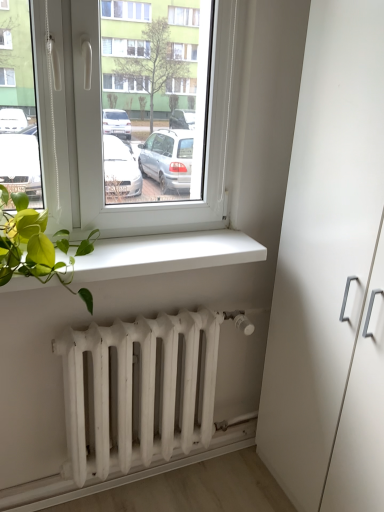
What is the approximate width of white matte window sill at lower center?

white matte window sill at lower center is 9.66 inches wide.

What do you see at coordinates (139, 392) in the screenshot? I see `white matte radiator at lower center` at bounding box center [139, 392].

Locate an element on the screen. The image size is (384, 512). white matte cabinet at right is located at coordinates (321, 249).

Locate an element on the screen. Image resolution: width=384 pixels, height=512 pixels. white matte radiator at lower center is located at coordinates (121, 473).

Can you confirm if white matte radiator at lower center is taller than white matte window sill at lower center?

Yes.

From a real-world perspective, relative to white matte window sill at lower center, is white matte radiator at lower center vertically above or below?

white matte radiator at lower center is below white matte window sill at lower center.

Is white matte radiator at lower center facing away from white matte window sill at lower center?

No, white matte radiator at lower center is not facing away from white matte window sill at lower center.

Considering the positions of points (193, 448) and (204, 251), is point (193, 448) farther from camera compared to point (204, 251)?

Yes, it is behind point (204, 251).

In the scene shown: Is white matte cabinet at right oriented towards white matte window sill at lower center?

Yes, white matte cabinet at right is facing white matte window sill at lower center.

Is point (292, 354) closer to camera compared to point (128, 271)?

No, it is behind (128, 271).

Does white matte cabinet at right appear on the left side of white matte window sill at lower center?

In fact, white matte cabinet at right is to the right of white matte window sill at lower center.

From a real-world perspective, who is located higher, white matte cabinet at right or white matte window sill at lower center?

In real-world perspective, white matte window sill at lower center is above.

From the picture: Which object is wider, white matte window sill at lower center or white matte radiator at lower center?

With larger width is white matte window sill at lower center.

The image size is (384, 512). In order to click on ledge below the white matte window sill at lower center (from a real-world perspective) in this screenshot , I will do `click(121, 473)`.

Can you confirm if white matte window sill at lower center is positioned to the left of white matte radiator at lower center?

No, white matte window sill at lower center is not to the left of white matte radiator at lower center.

Who is shorter, white matte window sill at lower center or white matte radiator at lower center?

With less height is white matte window sill at lower center.

Is white matte radiator at lower center bigger than white matte radiator at lower center?

No.

Is white matte radiator at lower center oriented towards white matte radiator at lower center?

No, white matte radiator at lower center is not facing towards white matte radiator at lower center.

From a real-world perspective, is white matte radiator at lower center above or below white matte radiator at lower center?

Clearly, from a real-world perspective, white matte radiator at lower center is below white matte radiator at lower center.

From a real-world perspective, is white matte cabinet at right positioned under white matte radiator at lower center based on gravity?

No, from a real-world perspective, white matte cabinet at right is not beneath white matte radiator at lower center.

Is white matte cabinet at right closer to camera compared to white matte radiator at lower center?

Yes.

Does white matte cabinet at right have a greater width compared to white matte radiator at lower center?

Correct, the width of white matte cabinet at right exceeds that of white matte radiator at lower center.

Does white matte radiator at lower center lie behind white matte window sill at lower center?

Yes, white matte radiator at lower center is further from the camera.

Is white matte radiator at lower center oriented away from white matte window sill at lower center?

No, white matte radiator at lower center is not facing the opposite direction of white matte window sill at lower center.

How different are the orientations of white matte radiator at lower center and white matte window sill at lower center in degrees?

There is a 0.0984-degree angle between the facing directions of white matte radiator at lower center and white matte window sill at lower center.

Would you say white matte radiator at lower center is inside or outside white matte radiator at lower center?

white matte radiator at lower center exists outside the volume of white matte radiator at lower center.

Does white matte radiator at lower center have a greater height compared to white matte radiator at lower center?

Yes.

Which object is wider, white matte radiator at lower center or white matte radiator at lower center?

Wider between the two is white matte radiator at lower center.

In the scene shown: Is white matte radiator at lower center at the back of white matte radiator at lower center?

white matte radiator at lower center does not have its back to white matte radiator at lower center.

At what (x,y) coordinates should I click in order to perform the action: click on radiator below the white matte window sill at lower center (from a real-world perspective). Please return your answer as a coordinate pair (x, y). Looking at the image, I should click on (139, 392).

In order to click on window sill located behind the white matte cabinet at right in this screenshot , I will do `click(166, 255)`.

From the image, which object appears to be nearer to white matte radiator at lower center, white matte radiator at lower center or white matte cabinet at right?

white matte radiator at lower center is closer to white matte radiator at lower center.

From the image, which object appears to be nearer to white matte cabinet at right, white matte radiator at lower center or white matte radiator at lower center?

white matte radiator at lower center.

Which object lies nearer to the anchor point white matte radiator at lower center, white matte radiator at lower center or white matte cabinet at right?

The object closer to white matte radiator at lower center is white matte radiator at lower center.

When comparing their distances from white matte radiator at lower center, does white matte cabinet at right or white matte window sill at lower center seem further?

white matte window sill at lower center is further to white matte radiator at lower center.

Based on their spatial positions, is white matte window sill at lower center or white matte radiator at lower center further from white matte cabinet at right?

The object further to white matte cabinet at right is white matte radiator at lower center.

Estimate the real-world distances between objects in this image. Which object is closer to white matte radiator at lower center, white matte window sill at lower center or white matte radiator at lower center?

Among the two, white matte radiator at lower center is located nearer to white matte radiator at lower center.

Estimate the real-world distances between objects in this image. Which object is closer to white matte cabinet at right, white matte radiator at lower center or white matte window sill at lower center?

Among the two, white matte window sill at lower center is located nearer to white matte cabinet at right.

When comparing their distances from white matte radiator at lower center, does white matte radiator at lower center or white matte window sill at lower center seem closer?

white matte radiator at lower center is positioned closer to the anchor white matte radiator at lower center.

Find the location of a particular element. radiator that lies between white matte window sill at lower center and white matte radiator at lower center from top to bottom is located at coordinates (139, 392).

Where is `radiator located between white matte radiator at lower center and white matte cabinet at right in the left-right direction`? The image size is (384, 512). radiator located between white matte radiator at lower center and white matte cabinet at right in the left-right direction is located at coordinates (x=139, y=392).

You are a GUI agent. You are given a task and a screenshot of the screen. Output one action in this format:
    pyautogui.click(x=<x>, y=<y>)
    Task: Click on the window sill between white matte radiator at lower center and white matte cabinet at right from left to right
    The image size is (384, 512).
    Given the screenshot: What is the action you would take?
    (x=166, y=255)

Locate an element on the screen. The image size is (384, 512). radiator situated between white matte window sill at lower center and white matte cabinet at right from left to right is located at coordinates (139, 392).